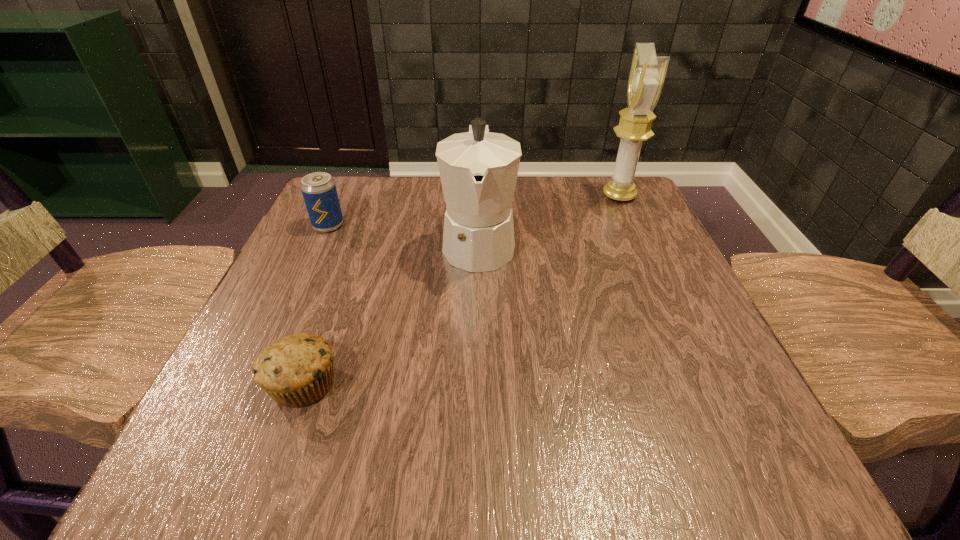
Image resolution: width=960 pixels, height=540 pixels. In order to click on the farthest object in this screenshot , I will do `click(647, 73)`.

Identify the location of the tallest object. Image resolution: width=960 pixels, height=540 pixels. (647, 73).

At what (x,y) coordinates should I click in order to perform the action: click on the second object from right to left. Please return your answer as a coordinate pair (x, y). Looking at the image, I should click on (478, 169).

Identify the location of coffeepot. (478, 169).

Locate an element on the screen. The image size is (960, 540). the third tallest object is located at coordinates (319, 191).

I want to click on the shortest object, so click(297, 370).

In order to click on muffin in this screenshot , I will do `click(297, 370)`.

Locate an element on the screen. The height and width of the screenshot is (540, 960). free space located 0.150m on the front-facing side of the rightmost object is located at coordinates (540, 196).

Locate an element on the screen. vacant space situated on the front-facing side of the rightmost object is located at coordinates (477, 196).

Identify the location of free location located 0.260m on the front-facing side of the rightmost object. This screenshot has width=960, height=540. (493, 196).